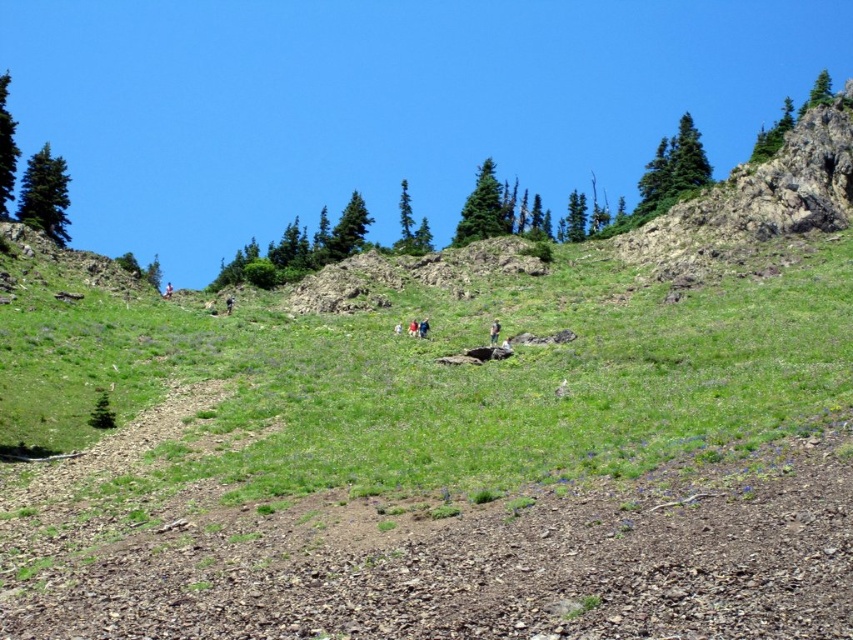
Question: Estimate the real-world distances between objects in this image. Which object is farther from the green fabric pants at center?

Choices:
 (A) light brown fabric jacket at center
 (B) green grassy at center

Answer: (B)

Question: Can you confirm if green fabric pants at center is positioned above light brown fabric jacket at center?

Choices:
 (A) no
 (B) yes

Answer: (B)

Question: Which object is closer to the camera taking this photo?

Choices:
 (A) green grassy at center
 (B) light brown fabric jacket at center
 (C) green fabric pants at center

Answer: (A)

Question: Which point is farther from the camera taking this photo?

Choices:
 (A) (416, 323)
 (B) (490, 346)

Answer: (A)

Question: Observing the image, what is the correct spatial positioning of green fabric pants at center in reference to light brown fabric jacket at center?

Choices:
 (A) left
 (B) right

Answer: (B)

Question: Does green fabric pants at center come in front of light brown fabric jacket at center?

Choices:
 (A) no
 (B) yes

Answer: (B)